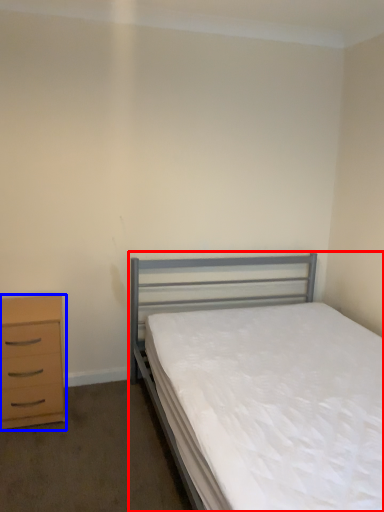
Question: Which object appears farthest to the camera in this image, bed (highlighted by a red box) or chest of drawers (highlighted by a blue box)?

Choices:
 (A) bed
 (B) chest of drawers

Answer: (B)